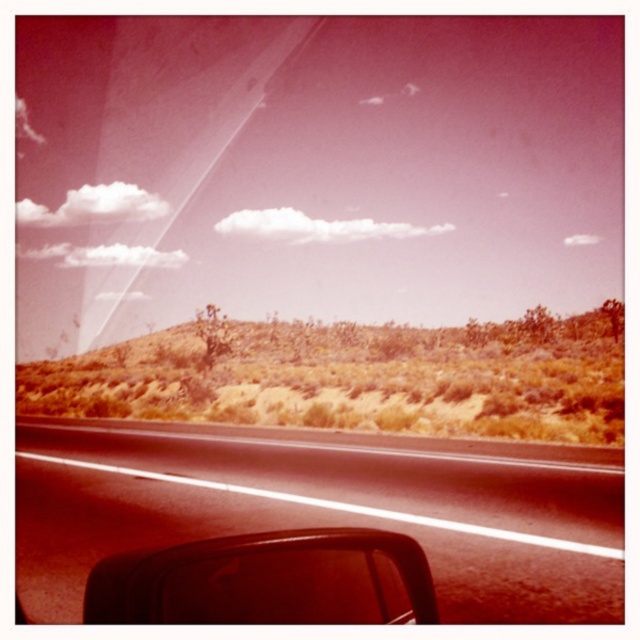
Question: Which of the following is the farthest from the observer?

Choices:
 (A) (461, 120)
 (B) (97, 566)
 (C) (237, 353)
 (D) (589, 499)

Answer: (A)

Question: Is black asphalt road at center further to the viewer compared to desertgrassy/sandyhills at lower center?

Choices:
 (A) no
 (B) yes

Answer: (A)

Question: Can you confirm if transparent glass car window at center is positioned to the left of black asphalt road at center?

Choices:
 (A) yes
 (B) no

Answer: (A)

Question: Which object appears closest to the camera in this image?

Choices:
 (A) black asphalt road at center
 (B) desertgrassy/sandyhills at lower center
 (C) transparent glass car window at center

Answer: (A)

Question: Estimate the real-world distances between objects in this image. Which object is closer to the black asphalt road at center?

Choices:
 (A) transparent glass car window at center
 (B) desertgrassy/sandyhills at lower center
 (C) matte black view mirror at lower left

Answer: (C)

Question: Can you confirm if black asphalt road at center is positioned to the left of desertgrassy/sandyhills at lower center?

Choices:
 (A) no
 (B) yes

Answer: (A)